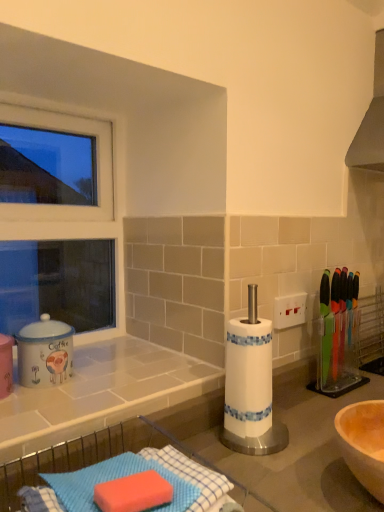
You are a GUI agent. You are given a task and a screenshot of the screen. Output one action in this format:
    pyautogui.click(x=<x>, y=<y>)
    Task: Click on the free space above white tile countertop at lower left, the second countertop from the bottom (from a real-world perspective)
    
    Given the screenshot: What is the action you would take?
    pyautogui.click(x=110, y=365)